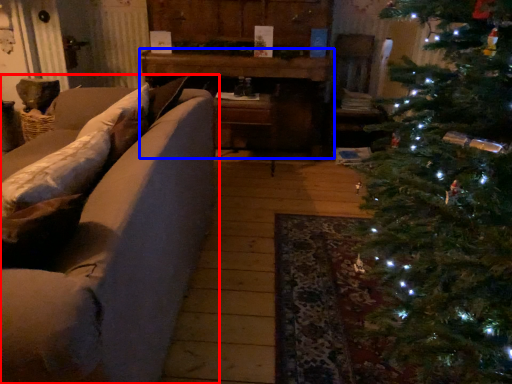
Question: Which point is further to the camera, studio couch (highlighted by a red box) or table (highlighted by a blue box)?

Choices:
 (A) studio couch
 (B) table

Answer: (B)